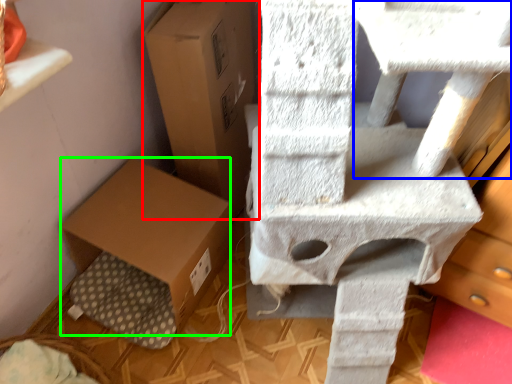
Question: Based on their relative distances, which object is farther from cardboard box (highlighted by a red box)? Choose from table (highlighted by a blue box) and cardboard box (highlighted by a green box).

Choices:
 (A) table
 (B) cardboard box

Answer: (A)